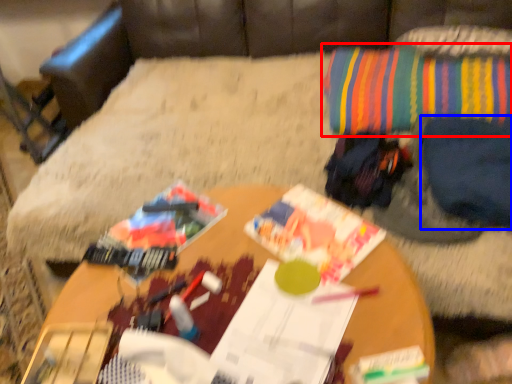
Question: Which object appears closest to the camera in this image, throw pillow (highlighted by a red box) or clothing (highlighted by a blue box)?

Choices:
 (A) throw pillow
 (B) clothing

Answer: (B)